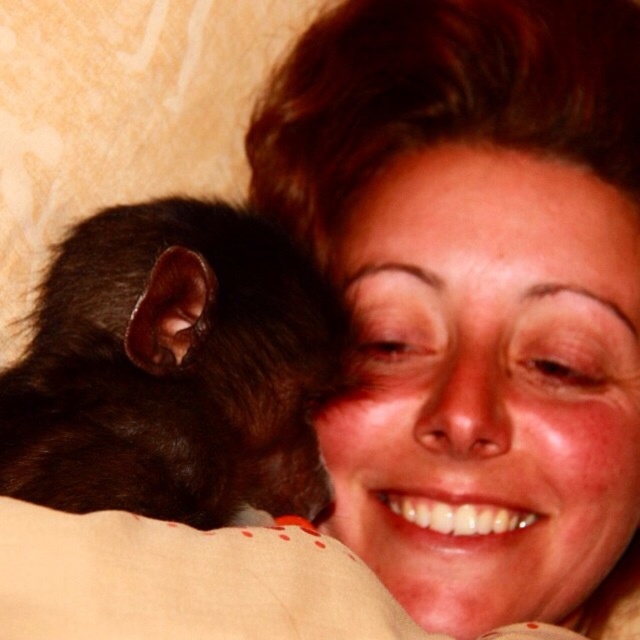
Based on the photo, can you confirm if matte black fur at upper center is positioned to the left of black furry mouse at left?

No, matte black fur at upper center is not to the left of black furry mouse at left.

Can you confirm if matte black fur at upper center is positioned below black furry mouse at left?

No, matte black fur at upper center is not below black furry mouse at left.

Does point (374, 515) lie behind point (314, 371)?

Yes.

Find the location of a particular element. This screenshot has width=640, height=640. matte black fur at upper center is located at coordinates (476, 289).